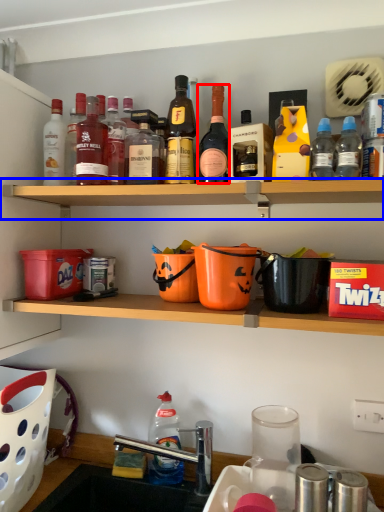
Question: Which point is closer to the camera, bottle (highlighted by a red box) or shelf (highlighted by a blue box)?

Choices:
 (A) bottle
 (B) shelf

Answer: (B)